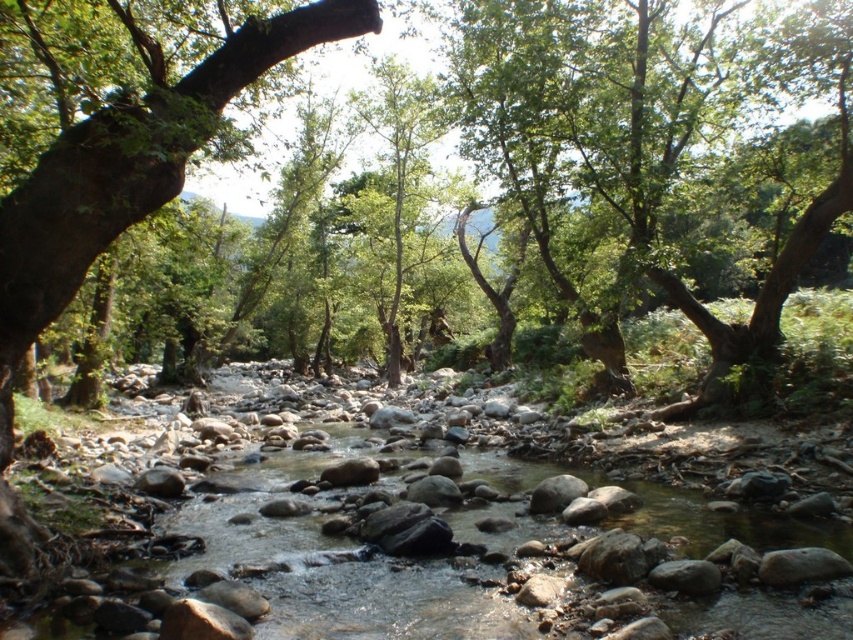
Question: Among these points, which one is nearest to the camera?

Choices:
 (A) (836, 90)
 (B) (30, 253)

Answer: (B)

Question: Is green leafy tree at upper center positioned in front of green rough bark tree at left?

Choices:
 (A) yes
 (B) no

Answer: (B)

Question: Is green leafy tree at upper center further to the viewer compared to green rough bark tree at left?

Choices:
 (A) no
 (B) yes

Answer: (B)

Question: Does green leafy tree at upper center appear on the right side of green rough bark tree at left?

Choices:
 (A) no
 (B) yes

Answer: (B)